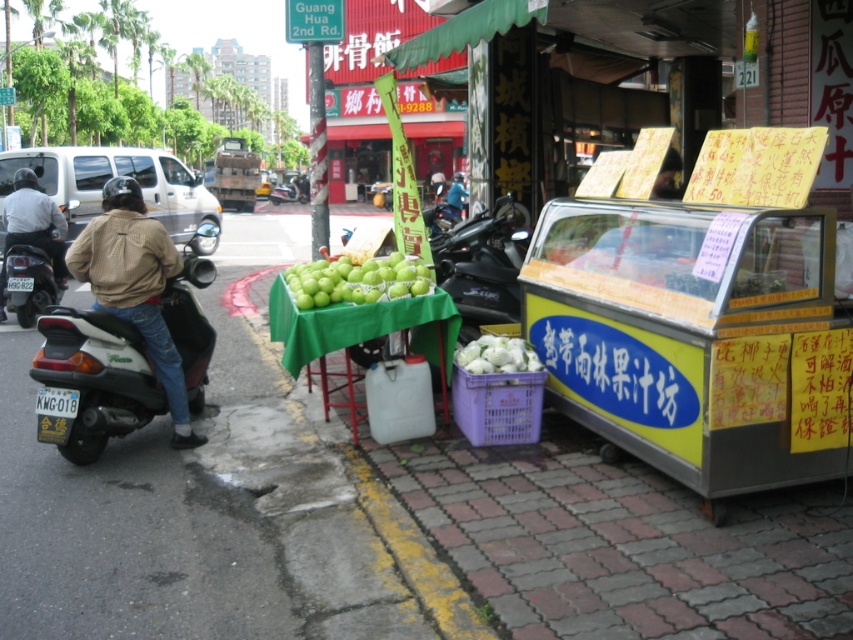
Who is higher up, matte black scooter at left or brown leather jacket at center?

brown leather jacket at center is above.

Looking at this image, which is more to the left, matte black scooter at left or brown leather jacket at center?

Positioned to the left is matte black scooter at left.

Which is behind, point (35, 294) or point (460, 182)?

The point (460, 182) is behind.

This screenshot has width=853, height=640. I want to click on matte black scooter at left, so click(28, 282).

Is green matte apples at center further to camera compared to brown leather jacket at center?

That is False.

Can you confirm if green matte apples at center is thinner than brown leather jacket at center?

Incorrect, green matte apples at center's width is not less than brown leather jacket at center's.

Who is more forward, (386, 292) or (451, 189)?

Point (386, 292) is in front.

This screenshot has height=640, width=853. Find the location of `green matte apples at center`. green matte apples at center is located at coordinates (357, 280).

Does white glossy scooter at left have a greater width compared to green matte apples at center?

In fact, white glossy scooter at left might be narrower than green matte apples at center.

Can you confirm if white glossy scooter at left is thinner than green matte apples at center?

Correct, white glossy scooter at left's width is less than green matte apples at center's.

Between point (97, 444) and point (352, 275), which one is positioned in front?

Point (97, 444)

The width and height of the screenshot is (853, 640). I want to click on white glossy scooter at left, so click(91, 380).